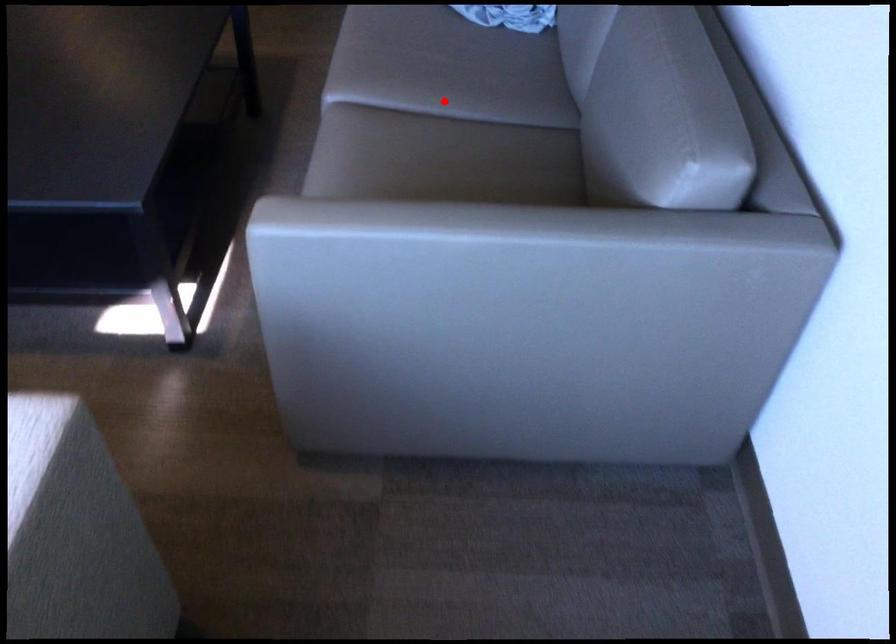
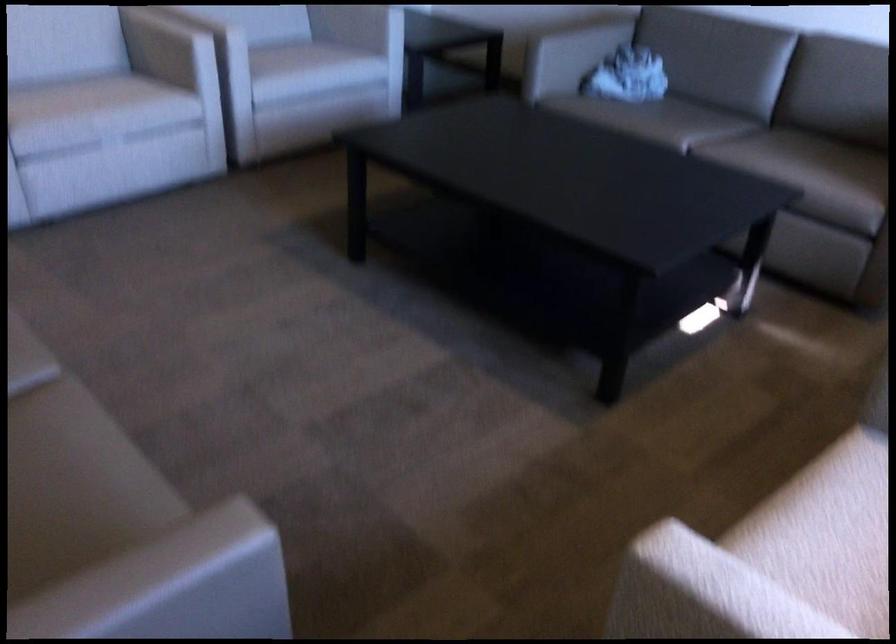
The point at the highlighted location is marked in the first image. Where is the corresponding point in the second image?

(714, 127)